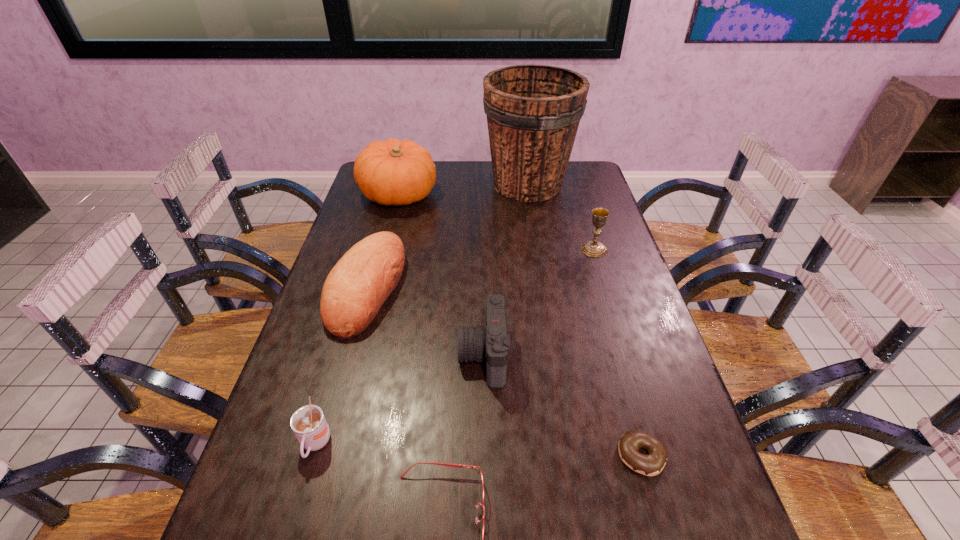
In order to click on vacant area between the second tallest object and the shortest object in this screenshot , I will do `click(519, 325)`.

Find the location of a particular element. vacant space in between the bread and the camera is located at coordinates (425, 321).

Locate an element on the screen. vacant area between the pumpkin and the camera is located at coordinates (441, 275).

At what (x,y) coordinates should I click in order to perform the action: click on free point between the chalice and the doughnut. Please return your answer as a coordinate pair (x, y). This screenshot has height=540, width=960. Looking at the image, I should click on (617, 353).

Locate an element on the screen. This screenshot has height=540, width=960. unoccupied area between the cup and the bread is located at coordinates (341, 366).

What are the coordinates of `object that is the fifth closest to the bread` in the screenshot? It's located at (481, 485).

This screenshot has height=540, width=960. In order to click on object that is the fourth closest to the camera in this screenshot , I will do `click(308, 423)`.

Find the location of `free location that satisfies the following two spatial constraints: 1. on the back side of the doughnut; 2. at the lens of the camera`. free location that satisfies the following two spatial constraints: 1. on the back side of the doughnut; 2. at the lens of the camera is located at coordinates (613, 355).